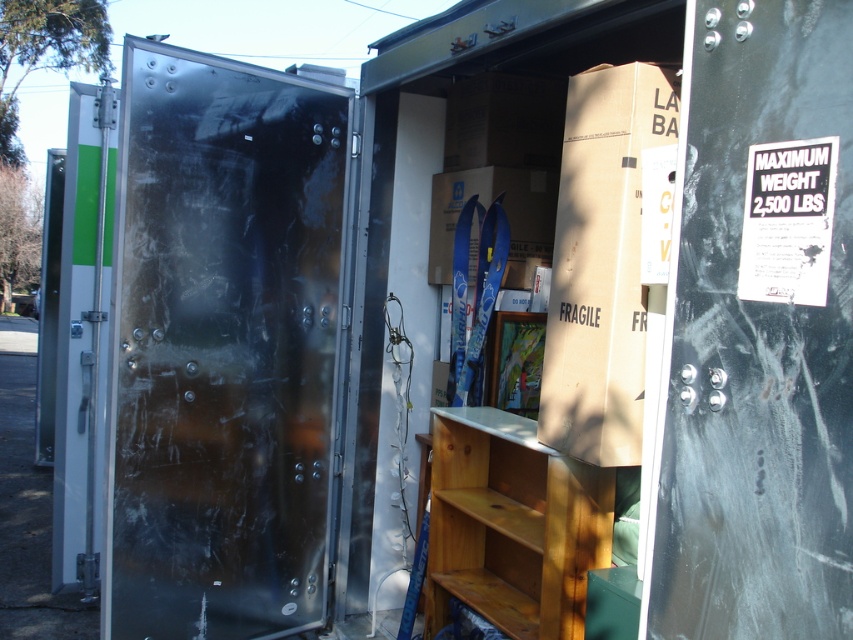
Which of these two, metallic silver door at left or silver metallic door at left, stands taller?

silver metallic door at left

Measure the distance between metallic silver door at left and camera.

metallic silver door at left and camera are 2.56 meters apart.

Is point (231, 232) positioned before point (90, 433)?

Yes, point (231, 232) is closer to viewer.

Find the location of `metallic silver door at left`. metallic silver door at left is located at coordinates (223, 346).

Between point (297, 147) and point (643, 96), which one is positioned in front?

Positioned in front is point (643, 96).

Does metallic silver door at left appear on the right side of brown cardboard box at center?

Incorrect, metallic silver door at left is not on the right side of brown cardboard box at center.

Who is more forward, (177, 193) or (619, 92)?

Point (619, 92)

Identify the location of metallic silver door at left. This screenshot has width=853, height=640. (223, 346).

Does brown cardboard box at center have a lesser height compared to silver metallic door at left?

Yes.

Which of these two, brown cardboard box at center or silver metallic door at left, stands shorter?

brown cardboard box at center

Where is `brown cardboard box at center`? The height and width of the screenshot is (640, 853). brown cardboard box at center is located at coordinates (605, 259).